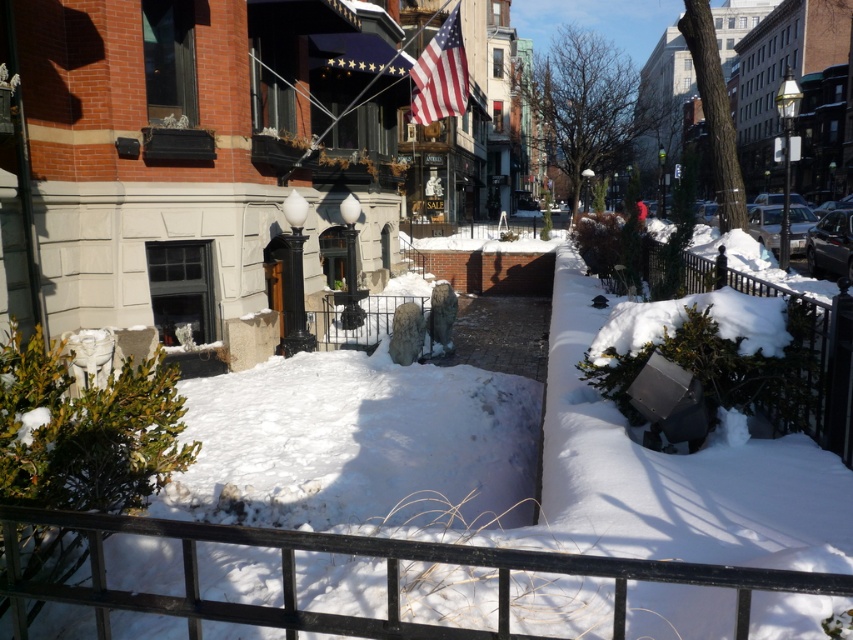
Does point (39, 512) come farther from viewer compared to point (424, 51)?

That is False.

Which of these two, black metal fence at lower center or american flag at upper center, stands taller?

american flag at upper center

The image size is (853, 640). What do you see at coordinates (357, 554) in the screenshot?
I see `black metal fence at lower center` at bounding box center [357, 554].

Where is `black metal fence at lower center`? This screenshot has width=853, height=640. black metal fence at lower center is located at coordinates (357, 554).